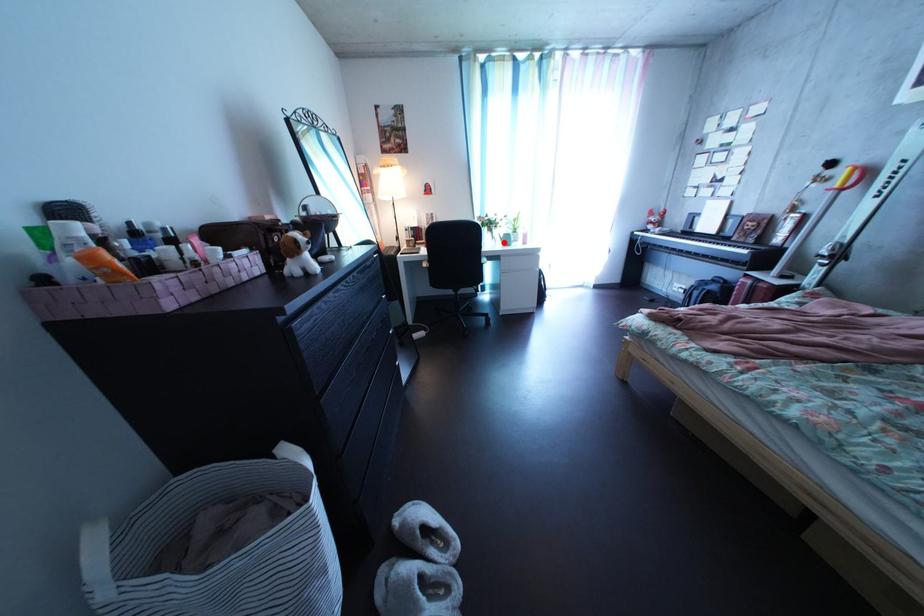
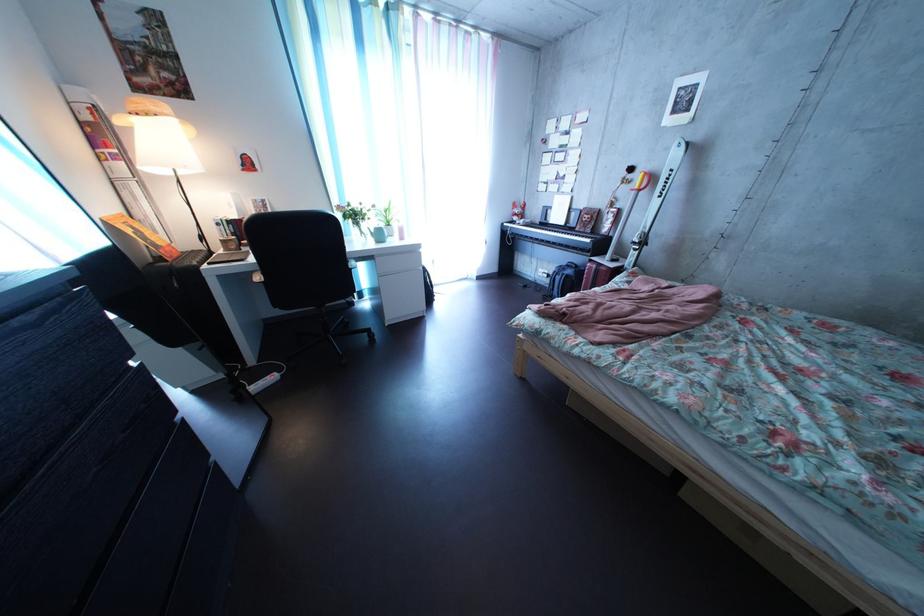
Locate, in the second image, the point that corresponds to the highlighted location in the first image.

(371, 237)